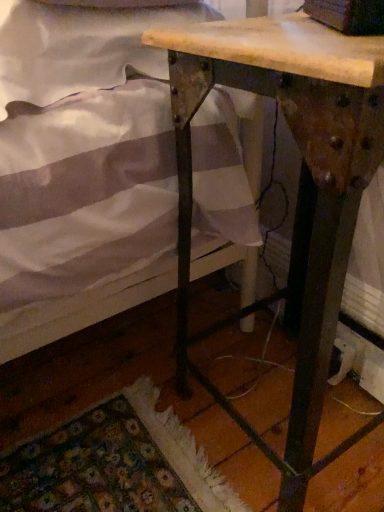
The width and height of the screenshot is (384, 512). Find the location of `vacant space to the left of wooden table at center`. vacant space to the left of wooden table at center is located at coordinates (140, 409).